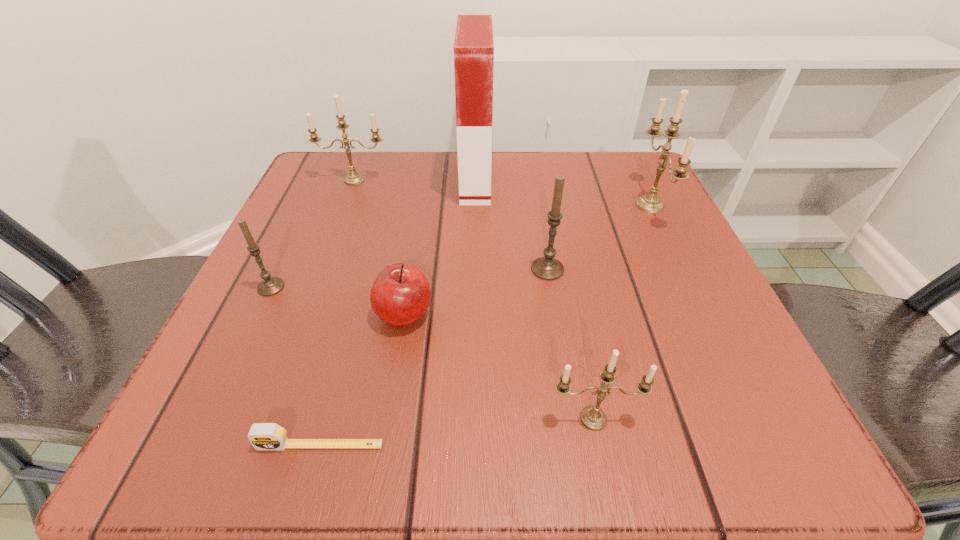
In order to click on the fifth object from left to right in this screenshot , I will do `click(473, 46)`.

The image size is (960, 540). I want to click on red cigarette_case, so click(x=473, y=46).

This screenshot has height=540, width=960. I want to click on the rightmost object, so click(x=651, y=203).

Identify the location of the seventh shortest object. This screenshot has height=540, width=960. (651, 203).

At what (x,y) coordinates should I click in order to perform the action: click on the bigger gray candle. Please return your answer as a coordinate pair (x, y). This screenshot has height=540, width=960. Looking at the image, I should click on (548, 268).

Locate an element on the screen. the second smallest metallic candle is located at coordinates (353, 178).

Identify the location of the smaller gray candle. Image resolution: width=960 pixels, height=540 pixels. (269, 286).

The width and height of the screenshot is (960, 540). I want to click on the smallest metallic candle, so click(592, 417).

At what (x,y) coordinates should I click in order to perform the action: click on the nearest metallic candle. Please return your answer as a coordinate pair (x, y). The image size is (960, 540). Looking at the image, I should click on (592, 417).

The image size is (960, 540). Identify the location of apple. (400, 295).